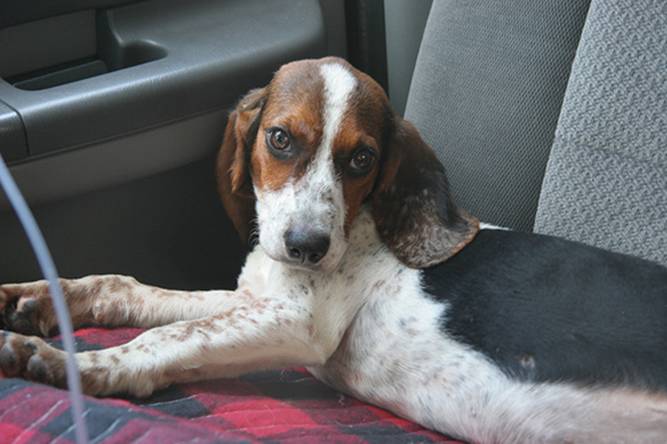
Where is `door handle`? Image resolution: width=667 pixels, height=444 pixels. door handle is located at coordinates (59, 77).